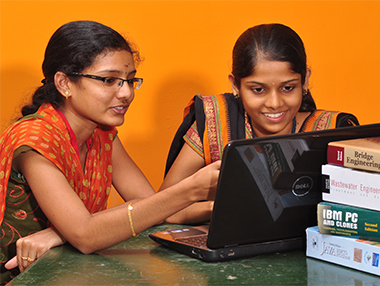
I want to click on tabletop, so click(145, 268).